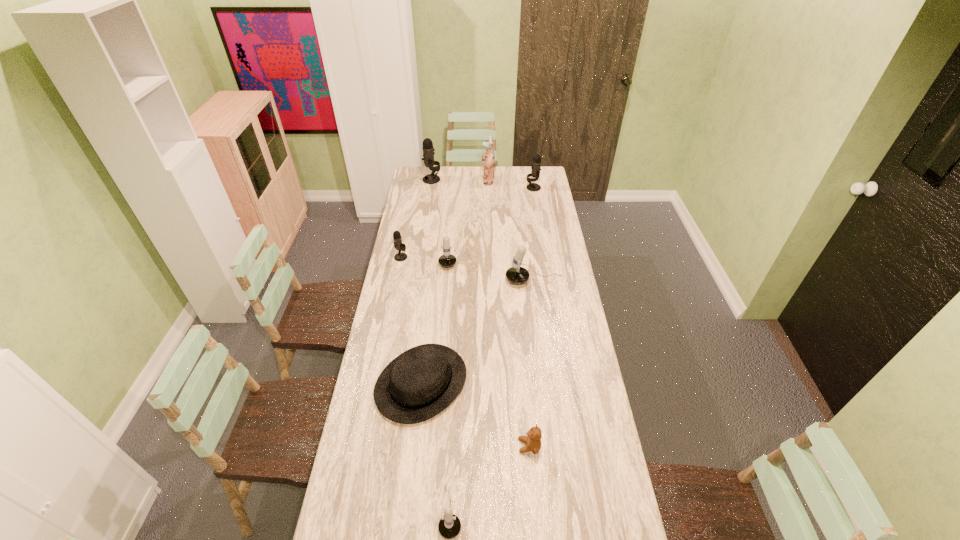
This screenshot has width=960, height=540. What are the coordinates of `pink figurine` in the screenshot? It's located at (488, 159).

Find the location of a particular element. This screenshot has height=540, width=960. figurine is located at coordinates (488, 159).

The image size is (960, 540). I want to click on the biggest black microphone, so click(x=428, y=150).

At what (x,y) coordinates should I click in order to perform the action: click on the tallest microphone. Please return your answer as a coordinate pair (x, y). Looking at the image, I should click on (428, 150).

Locate an element on the screen. the rightmost black microphone is located at coordinates (536, 163).

Identify the location of the fifth farthest microphone. The image size is (960, 540). (517, 275).

I want to click on the fourth nearest object, so click(x=517, y=275).

Locate an element on the screen. The image size is (960, 540). the second smallest white microphone is located at coordinates click(x=447, y=260).

Where is `the leftmost black microphone`? This screenshot has height=540, width=960. the leftmost black microphone is located at coordinates (398, 244).

Find the location of `the leftmost microphone`. the leftmost microphone is located at coordinates (398, 244).